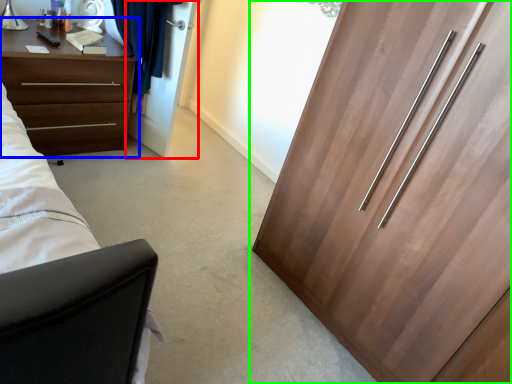
Question: Which object is positioned farthest from door (highlighted by a red box)? Select from chest of drawers (highlighted by a blue box) and cupboard (highlighted by a green box).

Choices:
 (A) chest of drawers
 (B) cupboard

Answer: (B)